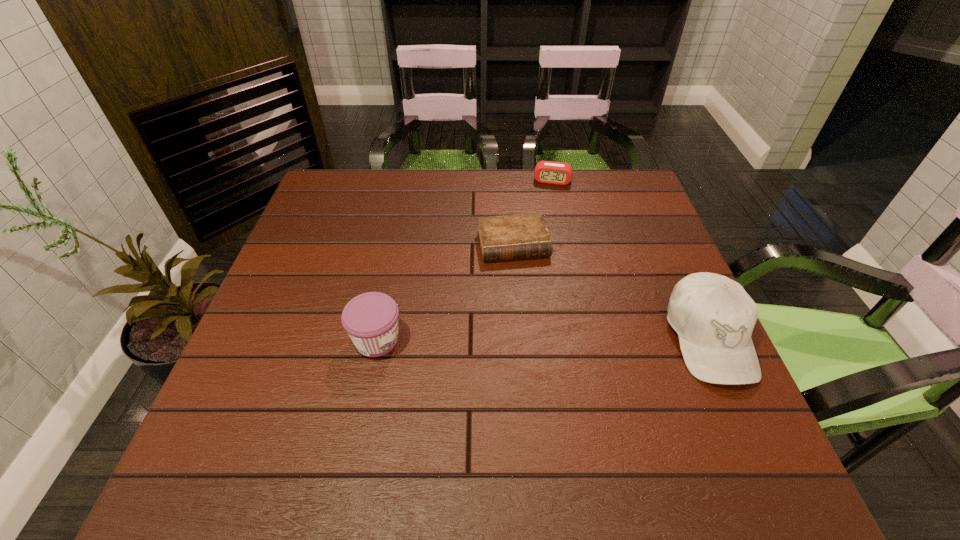
In the image, there is a desktop. Where is `vacant area at the far edge`? Image resolution: width=960 pixels, height=540 pixels. vacant area at the far edge is located at coordinates (566, 208).

This screenshot has height=540, width=960. I want to click on vacant region at the near edge, so coord(585,395).

In the image, there is a desktop. Find the location of `free space at the left edge`. free space at the left edge is located at coordinates (309, 218).

This screenshot has height=540, width=960. What are the coordinates of `vacant space at the right edge of the desktop` in the screenshot? It's located at (671, 354).

Locate an element on the screen. This screenshot has width=960, height=540. free space at the far left corner of the desktop is located at coordinates pos(363,171).

At what (x,y) coordinates should I click in order to perform the action: click on vacant area at the far right corner. Please return your answer as a coordinate pair (x, y). The image size is (960, 540). Looking at the image, I should click on (595, 170).

The width and height of the screenshot is (960, 540). In order to click on vacant area between the third shortest object and the diary in this screenshot , I will do `click(445, 292)`.

Find the location of a particular element. The width and height of the screenshot is (960, 540). vacant area between the baseball cap and the shortest object is located at coordinates (611, 292).

Image resolution: width=960 pixels, height=540 pixels. I want to click on empty space that is in between the baseball cap and the alarm clock, so click(x=631, y=259).

Where is `free spot between the third tallest object and the rightmost object`? The image size is (960, 540). free spot between the third tallest object and the rightmost object is located at coordinates (631, 259).